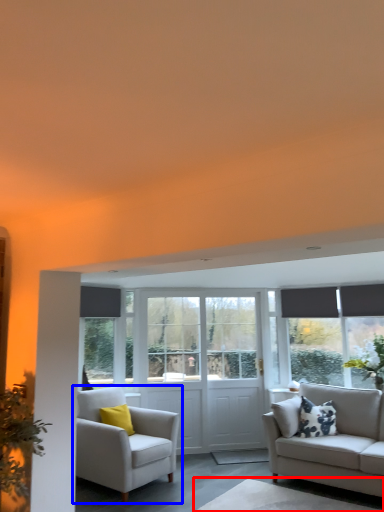
Question: Which object is further to the camera taking this photo, table (highlighted by a red box) or chair (highlighted by a blue box)?

Choices:
 (A) table
 (B) chair

Answer: (B)